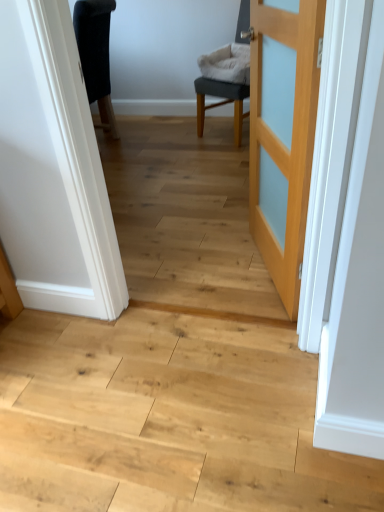
Identify the location of free spot behind light wood door at center. The height and width of the screenshot is (512, 384). (220, 228).